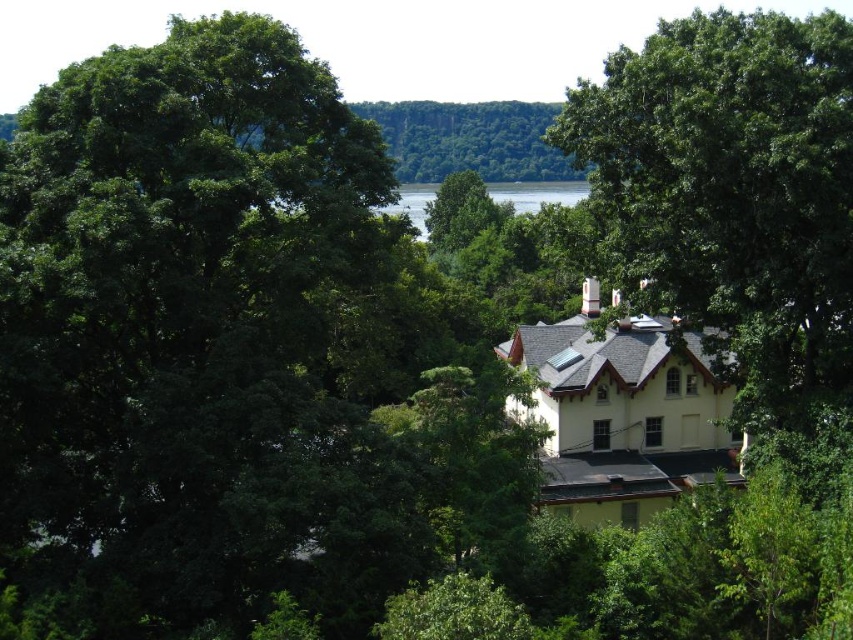
Does green leafy tree at center have a smaller size compared to green water at center?

Yes.

Does point (741, 195) lie behind point (566, 195)?

No, it is in front of (566, 195).

This screenshot has height=640, width=853. What are the coordinates of `green leafy tree at center` in the screenshot? It's located at (732, 195).